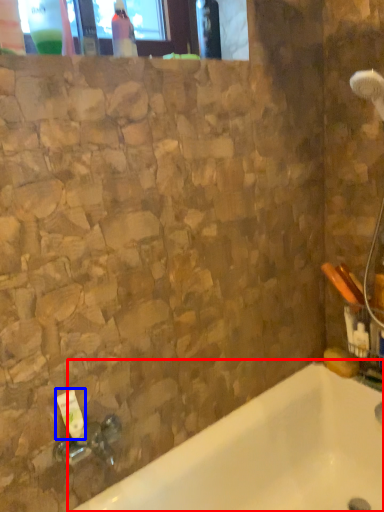
Question: Which object is closer to the camera taking this photo, bathtub (highlighted by a red box) or toiletry (highlighted by a blue box)?

Choices:
 (A) bathtub
 (B) toiletry

Answer: (A)